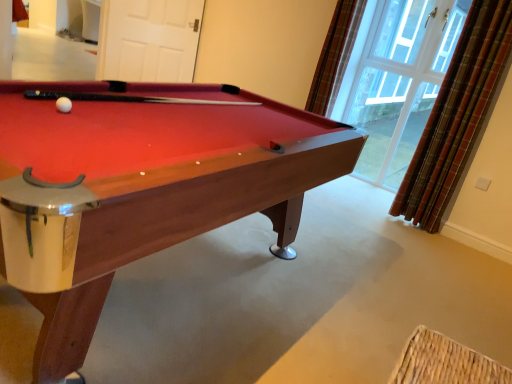
This screenshot has width=512, height=384. What do you see at coordinates (335, 56) in the screenshot?
I see `plaid fabric curtain at upper right, which is the 2th curtain in right-to-left order` at bounding box center [335, 56].

Find the location of a particular element. The height and width of the screenshot is (384, 512). plaid fabric curtain at upper right, which ranks as the first curtain in left-to-right order is located at coordinates (335, 56).

What do you see at coordinates (456, 115) in the screenshot?
I see `plaid fabric curtain at right, acting as the 1th curtain starting from the right` at bounding box center [456, 115].

What do you see at coordinates (146, 189) in the screenshot? This screenshot has width=512, height=384. I see `wooden billiard table at center` at bounding box center [146, 189].

Describe the element at coordinates (149, 40) in the screenshot. I see `white matte door at upper center` at that location.

This screenshot has height=384, width=512. What do you see at coordinates (64, 104) in the screenshot?
I see `white matte ball at upper left` at bounding box center [64, 104].

I want to click on plaid fabric curtain at upper right, which ranks as the first curtain in left-to-right order, so click(335, 56).

Can you confirm if clear glass window at upper right is bigger than plaid fabric curtain at upper right, which is the 2th curtain in right-to-left order?

Yes.

Would you say clear glass window at upper right contains plaid fabric curtain at upper right, which is the 2th curtain in right-to-left order?

No, plaid fabric curtain at upper right, which is the 2th curtain in right-to-left order, is not surrounded by clear glass window at upper right.

The image size is (512, 384). I want to click on the 1st curtain in front when counting from the clear glass window at upper right, so click(x=335, y=56).

Considering the sizes of clear glass window at upper right and plaid fabric curtain at upper right, which ranks as the first curtain in left-to-right order, in the image, is clear glass window at upper right wider or thinner than plaid fabric curtain at upper right, which ranks as the first curtain in left-to-right order,?

In the image, clear glass window at upper right appears to be more narrow than plaid fabric curtain at upper right, which ranks as the first curtain in left-to-right order.

Can you confirm if plaid fabric curtain at right, acting as the 1th curtain starting from the right, is shorter than plaid fabric curtain at upper right, which ranks as the first curtain in left-to-right order?

In fact, plaid fabric curtain at right, acting as the 1th curtain starting from the right, may be taller than plaid fabric curtain at upper right, which ranks as the first curtain in left-to-right order.

Which is in front, plaid fabric curtain at right, the 2th curtain in the left-to-right sequence, or plaid fabric curtain at upper right, which ranks as the first curtain in left-to-right order?

plaid fabric curtain at right, the 2th curtain in the left-to-right sequence, is closer to the camera.

Is plaid fabric curtain at right, acting as the 1th curtain starting from the right, located outside plaid fabric curtain at upper right, which is the 2th curtain in right-to-left order?

Absolutely, plaid fabric curtain at right, acting as the 1th curtain starting from the right, is external to plaid fabric curtain at upper right, which is the 2th curtain in right-to-left order.

From the image's perspective, is plaid fabric curtain at right, acting as the 1th curtain starting from the right, under white matte ball at upper left?

No, from the image's perspective, plaid fabric curtain at right, acting as the 1th curtain starting from the right, is not below white matte ball at upper left.

In the scene shown: Is plaid fabric curtain at right, acting as the 1th curtain starting from the right, inside the boundaries of white matte ball at upper left, or outside?

plaid fabric curtain at right, acting as the 1th curtain starting from the right, lies outside white matte ball at upper left.

Is the surface of plaid fabric curtain at right, the 2th curtain in the left-to-right sequence, in direct contact with white matte ball at upper left?

No, plaid fabric curtain at right, the 2th curtain in the left-to-right sequence, is not in contact with white matte ball at upper left.

Does plaid fabric curtain at right, the 2th curtain in the left-to-right sequence, have a lesser width compared to white matte ball at upper left?

Incorrect, the width of plaid fabric curtain at right, the 2th curtain in the left-to-right sequence, is not less than that of white matte ball at upper left.

Find the location of a particular element. The height and width of the screenshot is (384, 512). the 2nd curtain above the wooden billiard table at center (from the image's perspective) is located at coordinates (335, 56).

Does wooden billiard table at center have a greater height compared to plaid fabric curtain at upper right, which ranks as the first curtain in left-to-right order?

In fact, wooden billiard table at center may be shorter than plaid fabric curtain at upper right, which ranks as the first curtain in left-to-right order.

Between wooden billiard table at center and plaid fabric curtain at upper right, which ranks as the first curtain in left-to-right order, which one has larger width?

wooden billiard table at center.

Is wooden billiard table at center touching plaid fabric curtain at upper right, which ranks as the first curtain in left-to-right order?

No, wooden billiard table at center is not next to plaid fabric curtain at upper right, which ranks as the first curtain in left-to-right order.

From the image's perspective, between white matte door at upper center and white matte ball at upper left, which one is located above?

white matte door at upper center appears higher in the image.

Considering the relative sizes of white matte door at upper center and white matte ball at upper left in the image provided, is white matte door at upper center taller than white matte ball at upper left?

Correct, white matte door at upper center is much taller as white matte ball at upper left.

Is white matte door at upper center next to white matte ball at upper left?

No, white matte door at upper center is not touching white matte ball at upper left.

Considering the positions of points (106, 11) and (71, 101), is point (106, 11) farther from camera compared to point (71, 101)?

Yes, point (106, 11) is farther from viewer.

Consider the image. Is plaid fabric curtain at right, acting as the 1th curtain starting from the right, positioned far away from clear glass window at upper right?

No.

How many degrees apart are the facing directions of plaid fabric curtain at right, the 2th curtain in the left-to-right sequence, and clear glass window at upper right?

1.79 degrees separate the facing orientations of plaid fabric curtain at right, the 2th curtain in the left-to-right sequence, and clear glass window at upper right.

How distant is plaid fabric curtain at right, the 2th curtain in the left-to-right sequence, from clear glass window at upper right?

plaid fabric curtain at right, the 2th curtain in the left-to-right sequence, and clear glass window at upper right are 31.41 inches apart from each other.

Is plaid fabric curtain at right, the 2th curtain in the left-to-right sequence, inside the boundaries of clear glass window at upper right, or outside?

plaid fabric curtain at right, the 2th curtain in the left-to-right sequence, is outside clear glass window at upper right.

Considering the sizes of objects plaid fabric curtain at upper right, which ranks as the first curtain in left-to-right order, and white matte door at upper center in the image provided, who is shorter, plaid fabric curtain at upper right, which ranks as the first curtain in left-to-right order, or white matte door at upper center?

Standing shorter between the two is white matte door at upper center.

What's the angular difference between plaid fabric curtain at upper right, which is the 2th curtain in right-to-left order, and white matte door at upper center's facing directions?

There is a 58.5-degree angle between the facing directions of plaid fabric curtain at upper right, which is the 2th curtain in right-to-left order, and white matte door at upper center.

The height and width of the screenshot is (384, 512). In order to click on screen door on the left of plaid fabric curtain at upper right, which is the 2th curtain in right-to-left order in this screenshot , I will do `click(149, 40)`.

From a real-world perspective, is plaid fabric curtain at upper right, which is the 2th curtain in right-to-left order, on top of white matte door at upper center?

Yes, from a real-world perspective, plaid fabric curtain at upper right, which is the 2th curtain in right-to-left order, is over white matte door at upper center

This screenshot has height=384, width=512. In the image, there is a clear glass window at upper right. Identify the location of curtain above it (from the image's perspective). (335, 56).

I want to click on curtain positioned vertically above the plaid fabric curtain at right, acting as the 1th curtain starting from the right (from a real-world perspective), so click(x=335, y=56).

Looking at the image, which one is located closer to plaid fabric curtain at right, acting as the 1th curtain starting from the right, wooden billiard table at center or white matte ball at upper left?

Based on the image, wooden billiard table at center appears to be nearer to plaid fabric curtain at right, acting as the 1th curtain starting from the right.

Which object lies nearer to the anchor point plaid fabric curtain at upper right, which is the 2th curtain in right-to-left order, white matte ball at upper left or white matte door at upper center?

Among the two, white matte door at upper center is located nearer to plaid fabric curtain at upper right, which is the 2th curtain in right-to-left order.

Estimate the real-world distances between objects in this image. Which object is closer to clear glass window at upper right, plaid fabric curtain at upper right, which is the 2th curtain in right-to-left order, or white matte ball at upper left?

plaid fabric curtain at upper right, which is the 2th curtain in right-to-left order, lies closer to clear glass window at upper right than the other object.

When comparing their distances from plaid fabric curtain at right, acting as the 1th curtain starting from the right, does clear glass window at upper right or white matte door at upper center seem closer?

The object closer to plaid fabric curtain at right, acting as the 1th curtain starting from the right, is clear glass window at upper right.

Looking at the image, which one is located closer to plaid fabric curtain at upper right, which ranks as the first curtain in left-to-right order, plaid fabric curtain at right, the 2th curtain in the left-to-right sequence, or white matte door at upper center?

plaid fabric curtain at right, the 2th curtain in the left-to-right sequence, is positioned closer to the anchor plaid fabric curtain at upper right, which ranks as the first curtain in left-to-right order.

Considering their positions, is wooden billiard table at center positioned further to plaid fabric curtain at upper right, which ranks as the first curtain in left-to-right order, than clear glass window at upper right?

wooden billiard table at center.

From the image, which object appears to be nearer to plaid fabric curtain at upper right, which is the 2th curtain in right-to-left order, clear glass window at upper right or white matte door at upper center?

Among the two, clear glass window at upper right is located nearer to plaid fabric curtain at upper right, which is the 2th curtain in right-to-left order.

Based on their spatial positions, is wooden billiard table at center or clear glass window at upper right further from white matte ball at upper left?

clear glass window at upper right is further to white matte ball at upper left.

This screenshot has height=384, width=512. I want to click on curtain situated between white matte door at upper center and clear glass window at upper right from left to right, so click(x=335, y=56).

I want to click on curtain between wooden billiard table at center and plaid fabric curtain at upper right, which ranks as the first curtain in left-to-right order, from front to back, so click(x=456, y=115).

The height and width of the screenshot is (384, 512). Find the location of `ball located between wooden billiard table at center and plaid fabric curtain at upper right, which is the 2th curtain in right-to-left order, in the depth direction`. ball located between wooden billiard table at center and plaid fabric curtain at upper right, which is the 2th curtain in right-to-left order, in the depth direction is located at coordinates (64, 104).

I want to click on window situated between white matte door at upper center and plaid fabric curtain at right, acting as the 1th curtain starting from the right, from left to right, so click(397, 79).